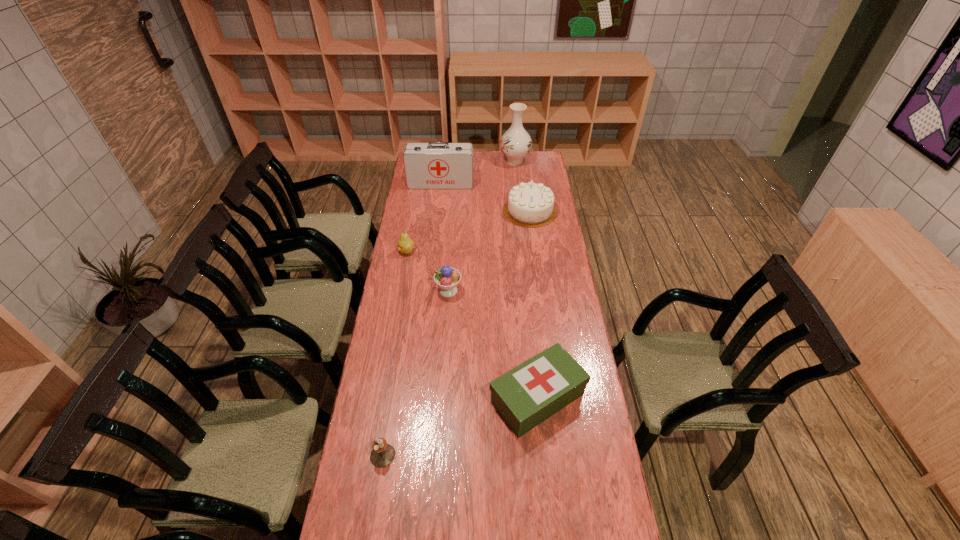
Where is `candle holder situated at the left edge`? This screenshot has height=540, width=960. candle holder situated at the left edge is located at coordinates (382, 455).

Where is `vase located at the right edge`? The height and width of the screenshot is (540, 960). vase located at the right edge is located at coordinates (516, 143).

Find the location of `birthday cake that is at the right edge`. birthday cake that is at the right edge is located at coordinates (530, 205).

This screenshot has height=540, width=960. I want to click on the first-aid kit at the right edge, so click(527, 395).

Find the location of a particular element. The image size is (960, 540). object that is at the far right corner is located at coordinates (x=516, y=143).

Image resolution: width=960 pixels, height=540 pixels. In order to click on vacant space at the far edge of the desktop in this screenshot , I will do `click(504, 161)`.

This screenshot has width=960, height=540. Identify the location of free space at the left edge of the desktop. (413, 197).

This screenshot has width=960, height=540. In the image, there is a desktop. Find the location of `vacant space at the right edge`. vacant space at the right edge is located at coordinates pyautogui.click(x=547, y=316).

Where is `empty space between the fourth nearest object and the farthest object`? empty space between the fourth nearest object and the farthest object is located at coordinates (461, 206).

Locate an element on the screen. vacant space that is in between the second farthest object and the fourth farthest object is located at coordinates (424, 217).